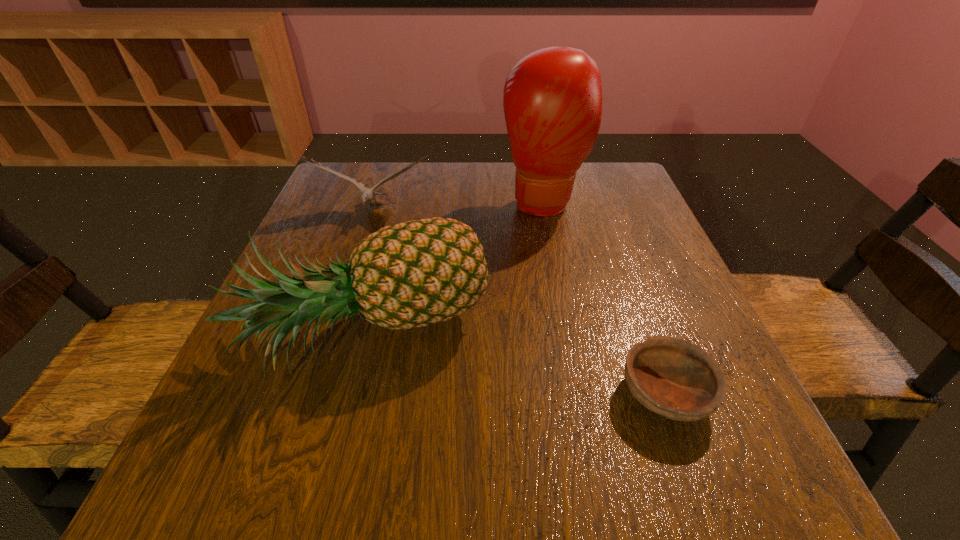
At what (x,y) coordinates should I click in order to perform the action: click on the tallest object. Please return your answer as a coordinate pair (x, y). Image resolution: width=960 pixels, height=540 pixels. Looking at the image, I should click on (552, 100).

I want to click on the second tallest object, so click(x=413, y=274).

Where is `gull`? The image size is (960, 540). gull is located at coordinates (367, 194).

I want to click on the shortest object, so [x=674, y=378].

This screenshot has height=540, width=960. In order to click on free region located 0.250m on the striking surface of the boxing glove in this screenshot , I will do `click(565, 307)`.

Identify the location of vacant area situated 0.060m on the back of the pineapple. (388, 261).

This screenshot has width=960, height=540. Find the location of `free spot located at the tip of the beak of the gull`. free spot located at the tip of the beak of the gull is located at coordinates (334, 334).

I want to click on vacant area situated 0.050m on the left of the shortest object, so click(588, 393).

Locate an element on the screen. Image resolution: width=960 pixels, height=540 pixels. boxing glove that is positioned at the far edge is located at coordinates (552, 100).

I want to click on gull that is positioned at the far edge, so click(x=367, y=194).